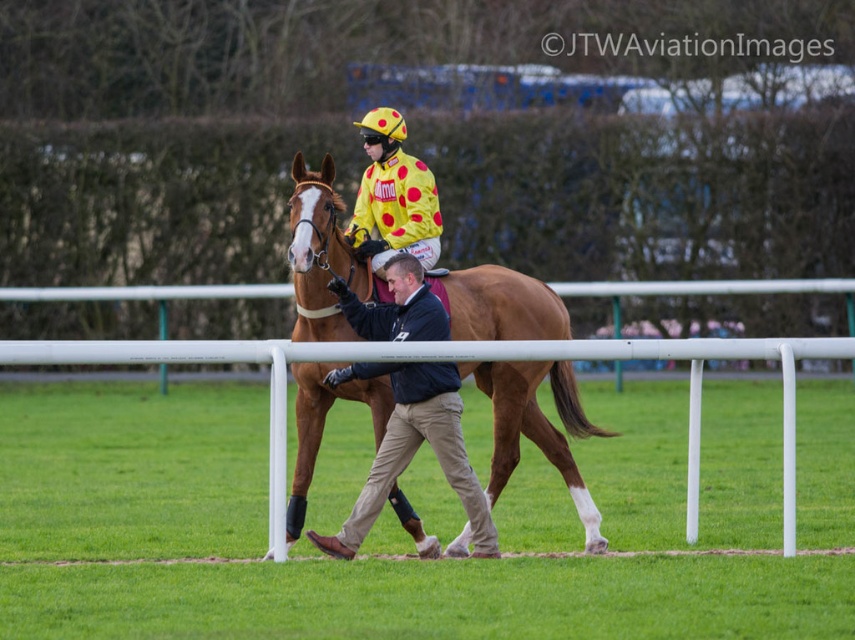
Question: Is white plastic rail at center further to the viewer compared to yellow dotted fabric at center?

Choices:
 (A) no
 (B) yes

Answer: (A)

Question: Does dark blue jacket at center have a greater width compared to yellow dotted fabric at center?

Choices:
 (A) no
 (B) yes

Answer: (B)

Question: Based on their relative distances, which object is nearer to the yellow dotted fabric at center?

Choices:
 (A) white plastic rail at center
 (B) dark blue jacket at center
 (C) brown glossy horse at center

Answer: (C)

Question: Which point appears farthest from the camera in this image?

Choices:
 (A) (268, 426)
 (B) (461, 445)
 (C) (568, 422)
 (D) (411, 176)

Answer: (A)

Question: Which object appears farthest from the camera in this image?

Choices:
 (A) dark blue jacket at center
 (B) yellow dotted fabric at center
 (C) brown glossy horse at center

Answer: (B)

Question: Does white plastic rail at center appear on the right side of dark blue jacket at center?

Choices:
 (A) yes
 (B) no

Answer: (B)